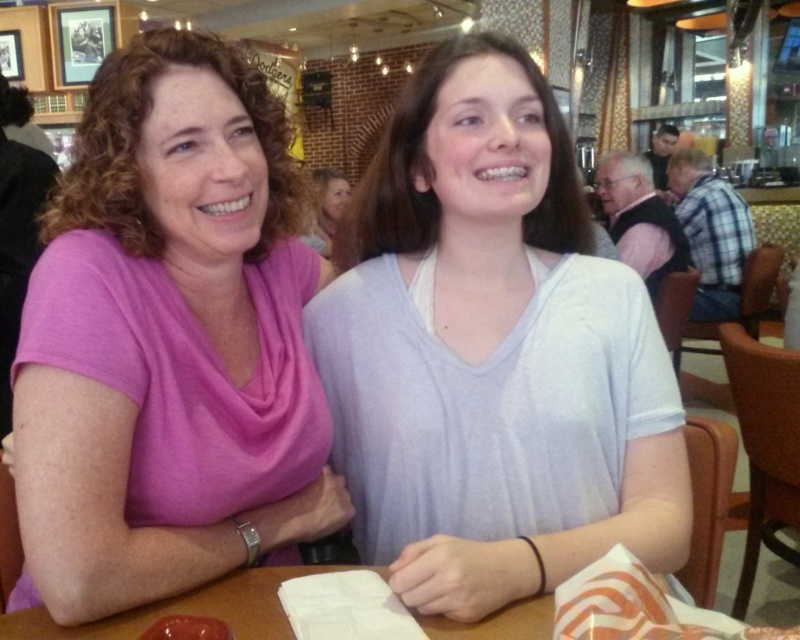
You are a photographer taking a picture of the pink soft fabric shirt at left and the wooden table at center. Which object should you focus on first if you want to capture both in the same frame without moving the camera?

The pink soft fabric shirt at left is much taller than the wooden table at center, so you should focus on the pink soft fabric shirt at left first to ensure it fits within the frame.

What is the location of the point at coordinates (x=182, y=611) in the image?

The point at coordinates (x=182, y=611) is located on the wooden table at center.

You are sitting at the wooden table at center and want to reach the pink soft fabric shirt at left. Which direction should you move to get closer to it?

Since the wooden table at center is behind the pink soft fabric shirt at left, you should move forward to get closer to the pink soft fabric shirt at left.